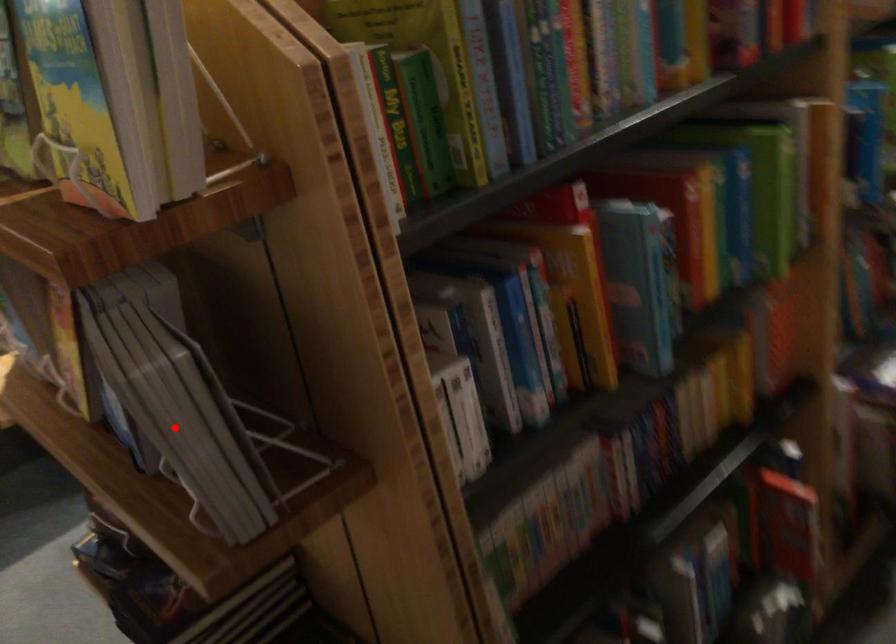
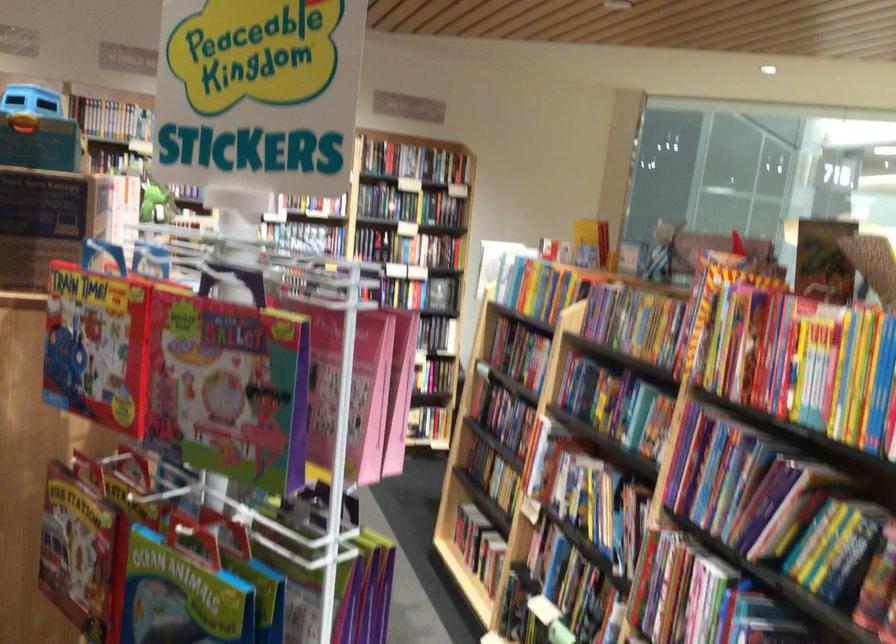
Question: I am providing you with two images of the same scene from different viewpoints. A red point is marked on the first image. Is the red point's position out of view in image 2?

Choices:
 (A) Yes
 (B) No

Answer: (A)